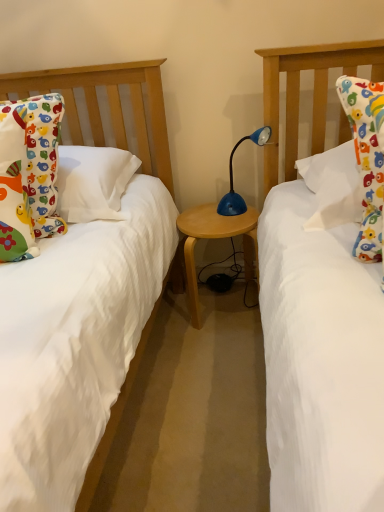
Question: Can you confirm if matte cotton pillow at left is wider than wooden table at center?

Choices:
 (A) no
 (B) yes

Answer: (A)

Question: From the image's perspective, is matte cotton pillow at left on top of wooden table at center?

Choices:
 (A) yes
 (B) no

Answer: (A)

Question: Does matte cotton pillow at left lie behind wooden table at center?

Choices:
 (A) no
 (B) yes

Answer: (A)

Question: Is wooden table at center completely or partially inside matte cotton pillow at left?

Choices:
 (A) yes
 (B) no

Answer: (B)

Question: Is matte cotton pillow at left taller than wooden table at center?

Choices:
 (A) yes
 (B) no

Answer: (A)

Question: Considering the positions of matte cotton pillow at left and blue plastic lamp at center in the image, is matte cotton pillow at left taller or shorter than blue plastic lamp at center?

Choices:
 (A) short
 (B) tall

Answer: (B)

Question: In terms of size, does matte cotton pillow at left appear bigger or smaller than blue plastic lamp at center?

Choices:
 (A) big
 (B) small

Answer: (A)

Question: Looking at their shapes, would you say matte cotton pillow at left is wider or thinner than blue plastic lamp at center?

Choices:
 (A) thin
 (B) wide

Answer: (B)

Question: From a real-world perspective, relative to blue plastic lamp at center, is matte cotton pillow at left vertically above or below?

Choices:
 (A) below
 (B) above

Answer: (B)

Question: From a real-world perspective, is blue plastic lamp at center positioned above or below wooden table at center?

Choices:
 (A) below
 (B) above

Answer: (B)

Question: Is blue plastic lamp at center bigger or smaller than wooden table at center?

Choices:
 (A) small
 (B) big

Answer: (A)

Question: From the image's perspective, relative to wooden table at center, is blue plastic lamp at center above or below?

Choices:
 (A) below
 (B) above

Answer: (B)

Question: In terms of height, does blue plastic lamp at center look taller or shorter compared to wooden table at center?

Choices:
 (A) short
 (B) tall

Answer: (A)

Question: Visually, is blue plastic lamp at center positioned to the left or to the right of matte cotton pillow at left?

Choices:
 (A) left
 (B) right

Answer: (B)

Question: From a real-world perspective, relative to matte cotton pillow at left, is blue plastic lamp at center vertically above or below?

Choices:
 (A) above
 (B) below

Answer: (B)